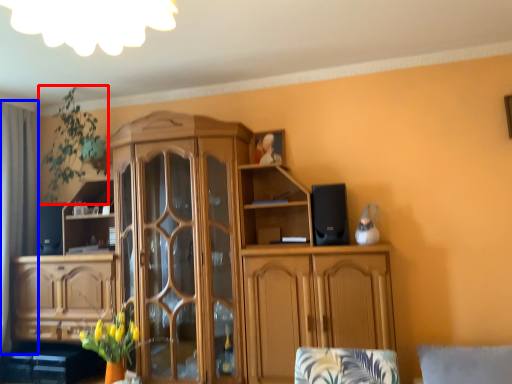
Question: Which object is closer to the camera taking this photo, plant (highlighted by a red box) or curtain (highlighted by a blue box)?

Choices:
 (A) plant
 (B) curtain

Answer: (A)